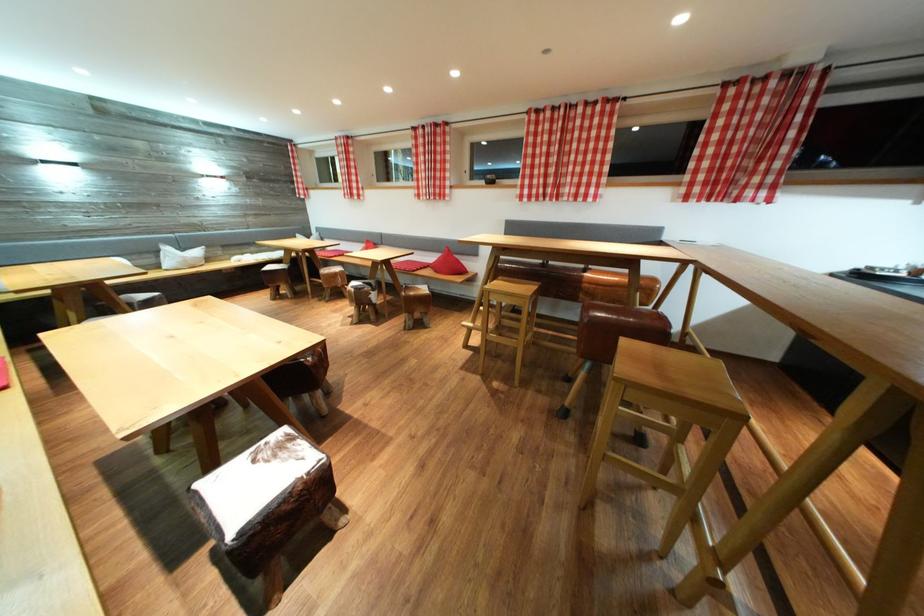
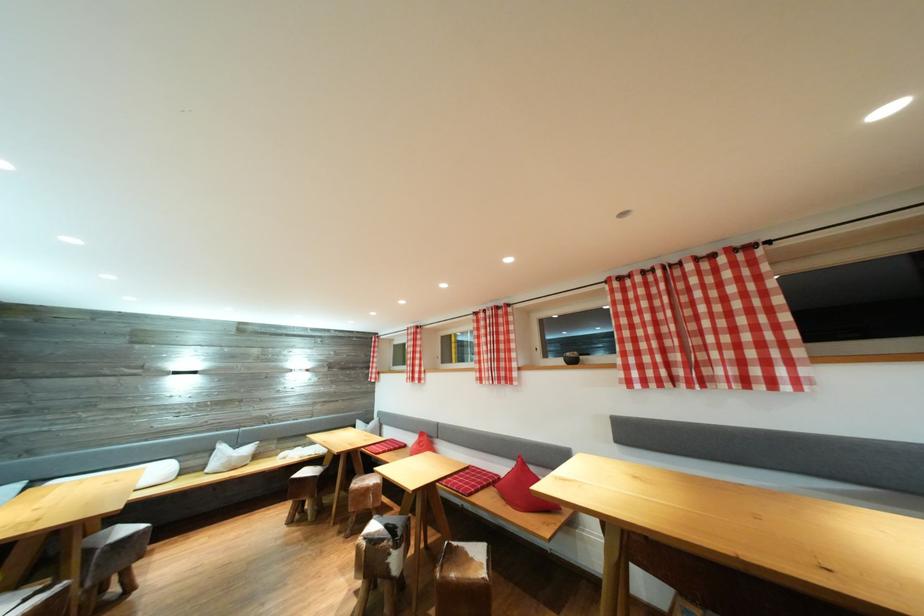
Find the pixel in the second image that matches [176,254] in the first image.

(228, 453)